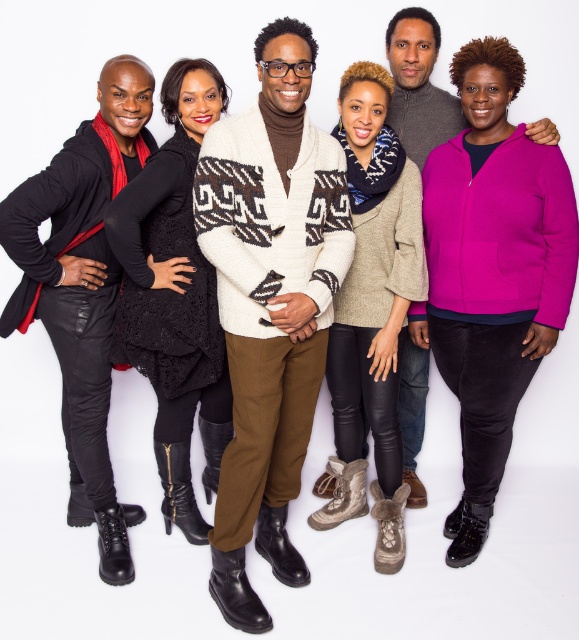
Question: Which is nearer to the fuzzy pink zip-up sweater at center-right?

Choices:
 (A) matte black jacket at left
 (B) black lace dress at center

Answer: (B)

Question: Observing the image, what is the correct spatial positioning of white wool sweater at center in reference to black lace dress at center?

Choices:
 (A) above
 (B) below

Answer: (B)

Question: Estimate the real-world distances between objects in this image. Which object is closer to the white wool sweater at center?

Choices:
 (A) knitted beige sweater at center
 (B) black lace dress at center
 (C) matte black jacket at left

Answer: (B)

Question: Which object is the farthest from the fuzzy pink zip-up sweater at center-right?

Choices:
 (A) white wool sweater at center
 (B) matte black jacket at left

Answer: (B)

Question: Can you confirm if fuzzy pink zip-up sweater at center-right is wider than knitted beige sweater at center?

Choices:
 (A) yes
 (B) no

Answer: (A)

Question: Is fuzzy pink zip-up sweater at center-right thinner than matte black jacket at left?

Choices:
 (A) yes
 (B) no

Answer: (A)